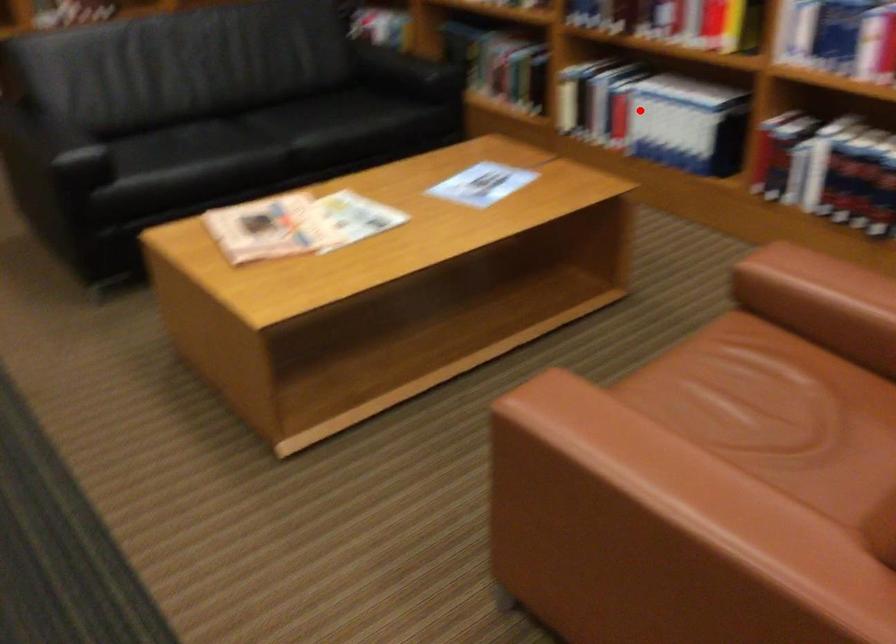
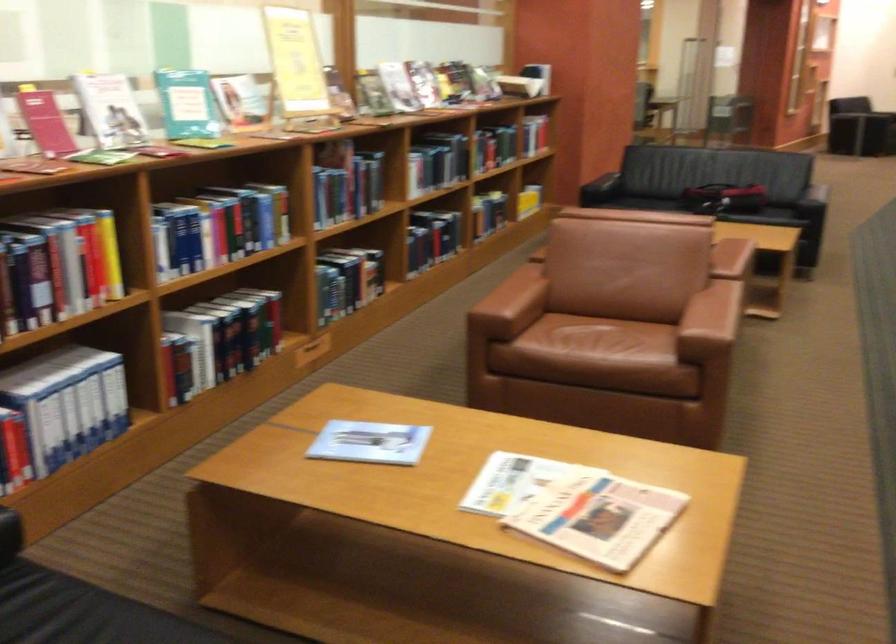
Question: A red point is marked in image1. In image2, is the corresponding 3D point closer to the camera or farther? Reply with the corresponding letter.

Choices:
 (A) The corresponding 3D point is closer.
 (B) The corresponding 3D point is farther.

Answer: (A)